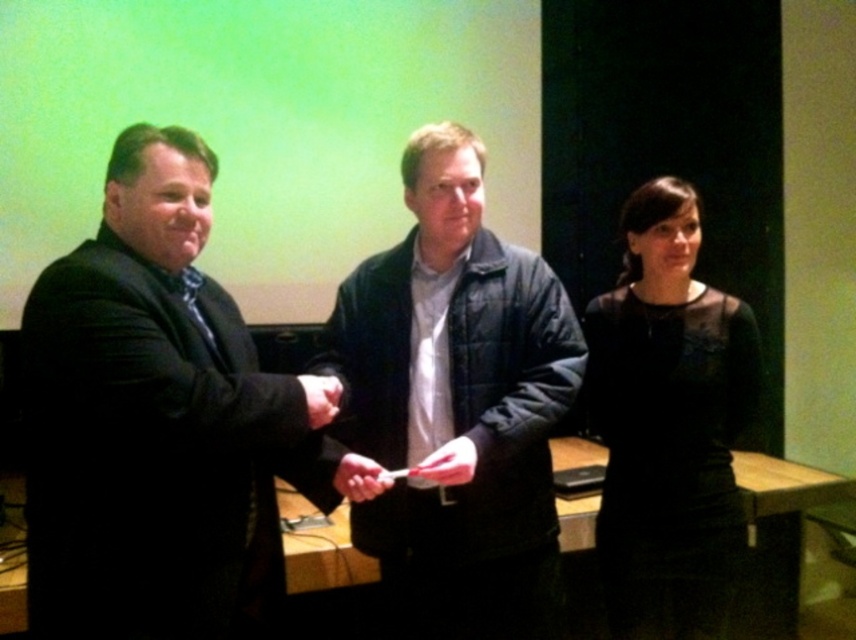
Is black suit at left in front of matte white paper at center?

Yes.

Does black suit at left have a greater height compared to matte white paper at center?

Yes, black suit at left is taller than matte white paper at center.

Locate an element on the screen. black suit at left is located at coordinates (153, 422).

Consider the image. Which of these two, quilted blue jacket at center or matte white paper at center, stands shorter?

matte white paper at center

Is point (452, 236) in front of point (361, 493)?

No, (452, 236) is further to viewer.

Describe the element at coordinates (456, 404) in the screenshot. Image resolution: width=856 pixels, height=640 pixels. I see `quilted blue jacket at center` at that location.

Where is `quilted blue jacket at center`? Image resolution: width=856 pixels, height=640 pixels. quilted blue jacket at center is located at coordinates (456, 404).

Is quilted blue jacket at center smaller than black sheer dress at right?

Actually, quilted blue jacket at center might be larger than black sheer dress at right.

Is quilted blue jacket at center positioned at the back of black sheer dress at right?

No, quilted blue jacket at center is closer to the viewer.

The image size is (856, 640). Identify the location of quilted blue jacket at center. (456, 404).